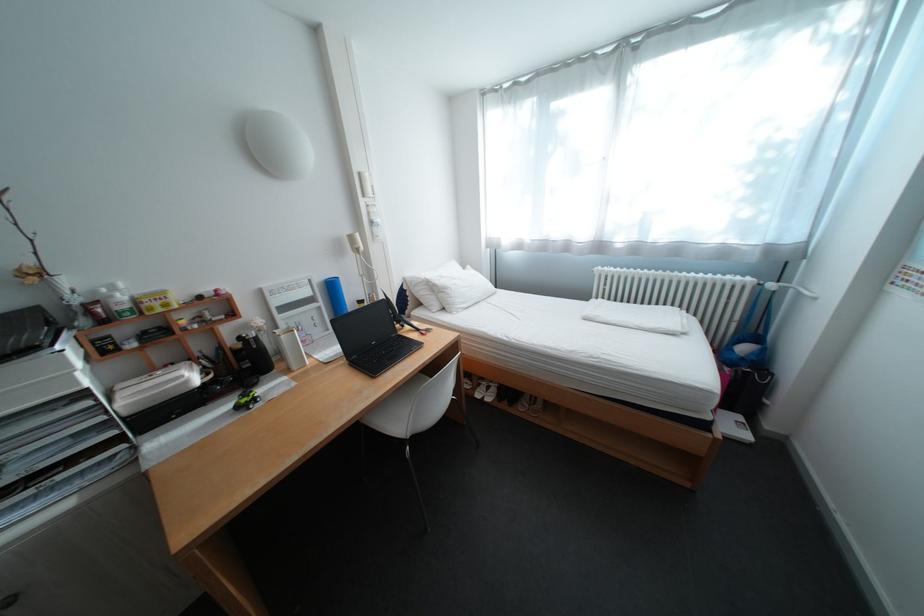
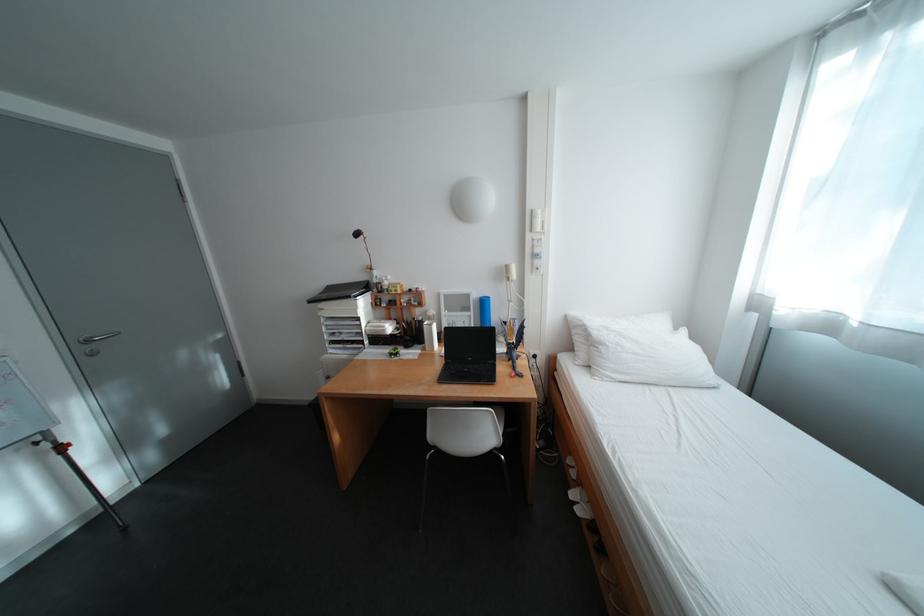
Find the pixel in the second image that matches (x=334, y=304) in the first image.

(484, 314)